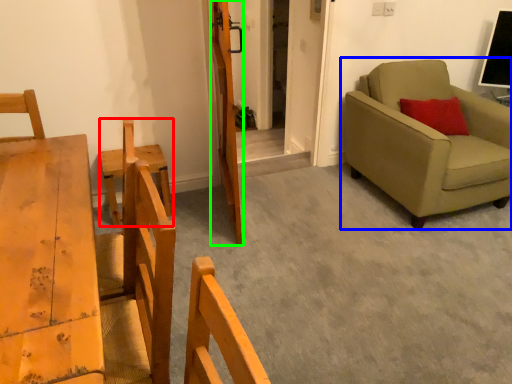
Question: Which object is the farthest from armchair (highlighted by a red box)? Choose among these: studio couch (highlighted by a blue box) or door (highlighted by a green box).

Choices:
 (A) studio couch
 (B) door

Answer: (A)